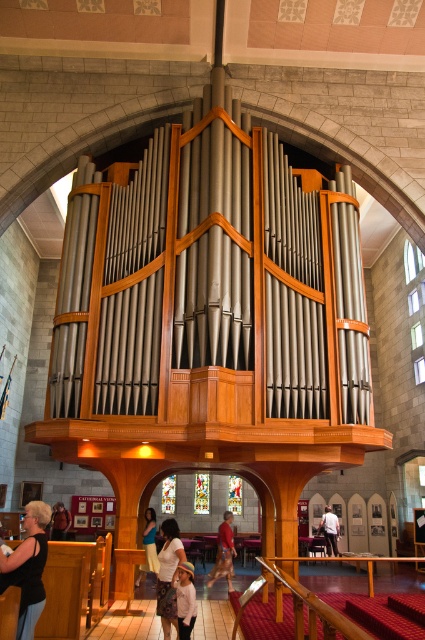
Question: Can you confirm if white cotton shirt at lower center is smaller than red shirt at center?

Choices:
 (A) no
 (B) yes

Answer: (B)

Question: Does white cotton shirt at center appear over matte black person at lower left?

Choices:
 (A) yes
 (B) no

Answer: (B)

Question: Estimate the real-world distances between objects in this image. Which object is closer to the matte black person at lower left?

Choices:
 (A) matte black shirt at lower left
 (B) white cotton shirt at center
 (C) red shirt at center
 (D) white cotton shirt at lower center

Answer: (C)

Question: Which object is the farthest from the matte black shirt at lower left?

Choices:
 (A) matte white shirt at lower center
 (B) red shirt at center

Answer: (B)

Question: Among these points, which one is nearest to the camera?

Choices:
 (A) (25, 564)
 (B) (164, 573)
 (C) (226, 525)

Answer: (A)

Question: Is matte white shirt at lower center below red shirt at center?

Choices:
 (A) yes
 (B) no

Answer: (B)